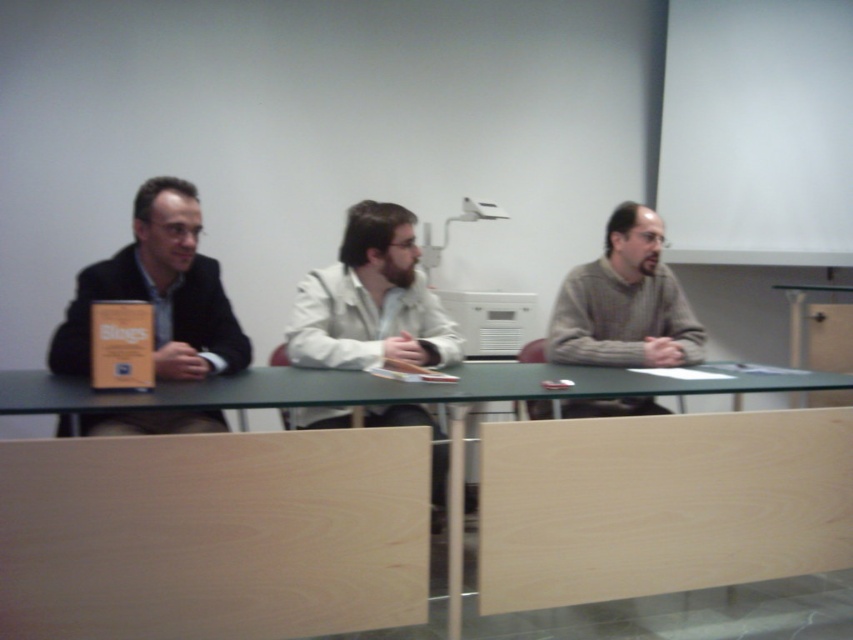
You are a guest entering the conference room and need to sit down. There is a matte black jacket at left and a green matte table at center. Which object is closer to you as you enter the room?

The matte black jacket at left is closer to you because the green matte table at center is behind it.

You are a photographer standing at the camera position. You want to take a closeup photo of the matte black jacket at left. The minimum focusing distance of your camera is 5 feet. Is it possible?

The matte black jacket at left is 5.55 feet from camera, so yes, the camera can focus on the matte black jacket at left since its distance is within the minimum focusing distance of 5 feet.